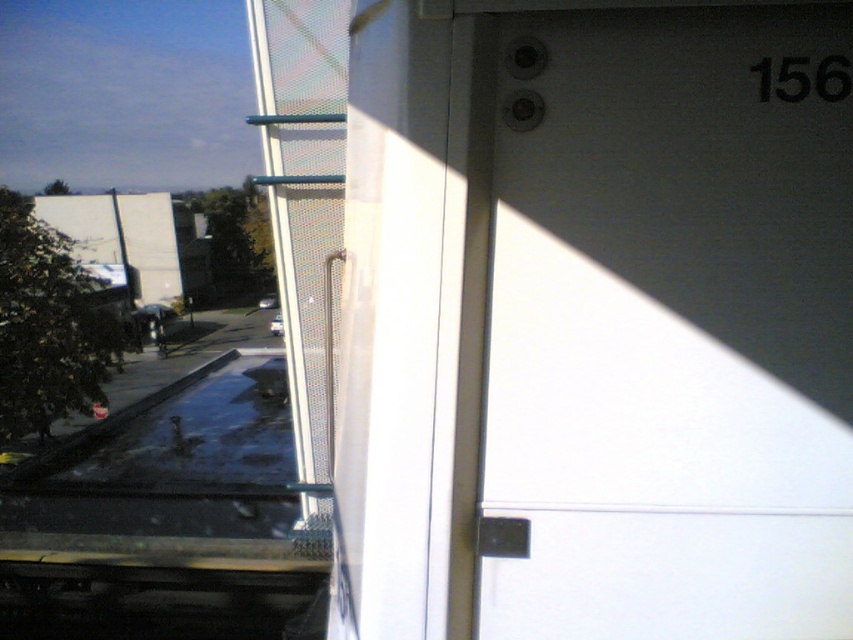
Question: Is white matte door at upper right to the right of transparent glass pool at lower left from the viewer's perspective?

Choices:
 (A) no
 (B) yes

Answer: (B)

Question: Among these objects, which one is farthest from the camera?

Choices:
 (A) white matte door at upper right
 (B) transparent glass pool at lower left

Answer: (B)

Question: Is white matte door at upper right wider than transparent glass pool at lower left?

Choices:
 (A) yes
 (B) no

Answer: (B)

Question: Among these objects, which one is nearest to the camera?

Choices:
 (A) transparent glass pool at lower left
 (B) white matte door at upper right

Answer: (B)

Question: Which of the following is the closest to the observer?

Choices:
 (A) white matte door at upper right
 (B) transparent glass pool at lower left

Answer: (A)

Question: Does white matte door at upper right have a smaller size compared to transparent glass pool at lower left?

Choices:
 (A) yes
 (B) no

Answer: (A)